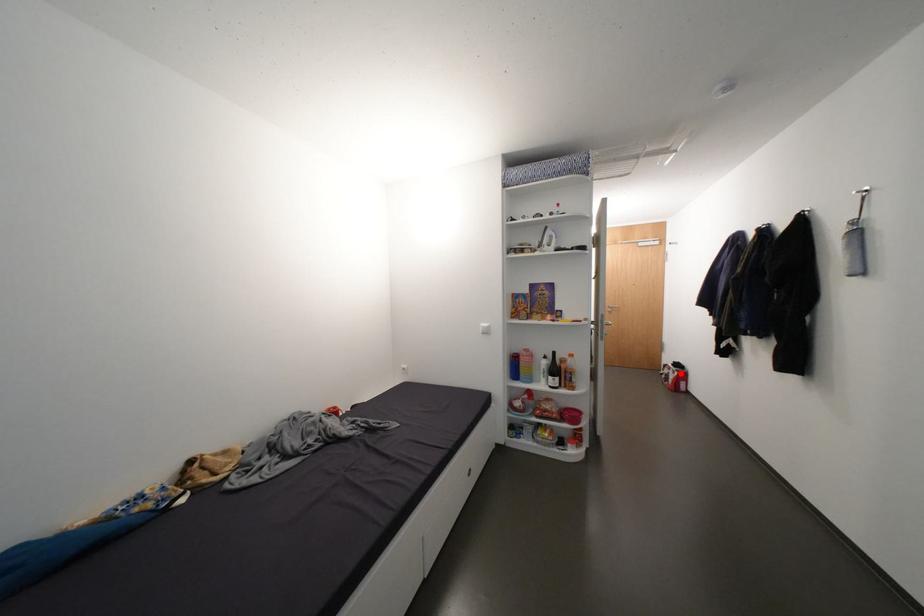
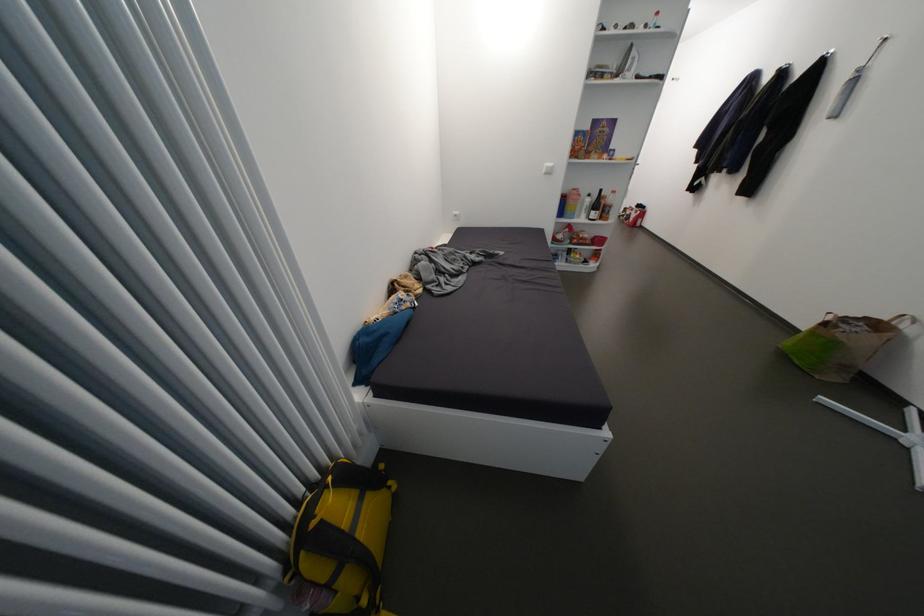
Question: I am providing you with two images of the same scene from different viewpoints. A red point is marked on the first image. Is the red point's position out of view in image 2?

Choices:
 (A) Yes
 (B) No

Answer: (B)